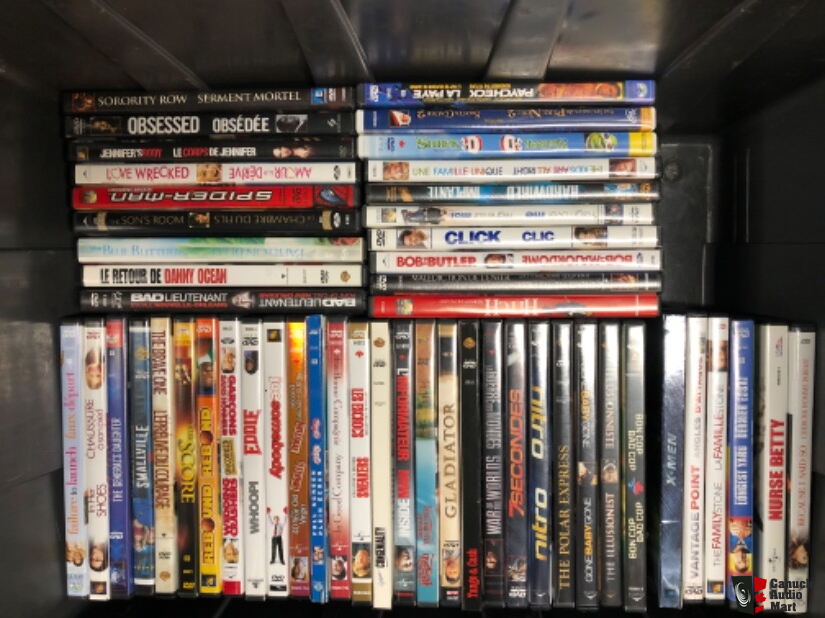
Image resolution: width=825 pixels, height=618 pixels. What are the coordinates of `books stacked horizontally on right side` in the screenshot? It's located at 535,306, 536,277, 540,261, 531,234, 528,214, 522,188, 512,166, 512,144, 508,117, 500,86.